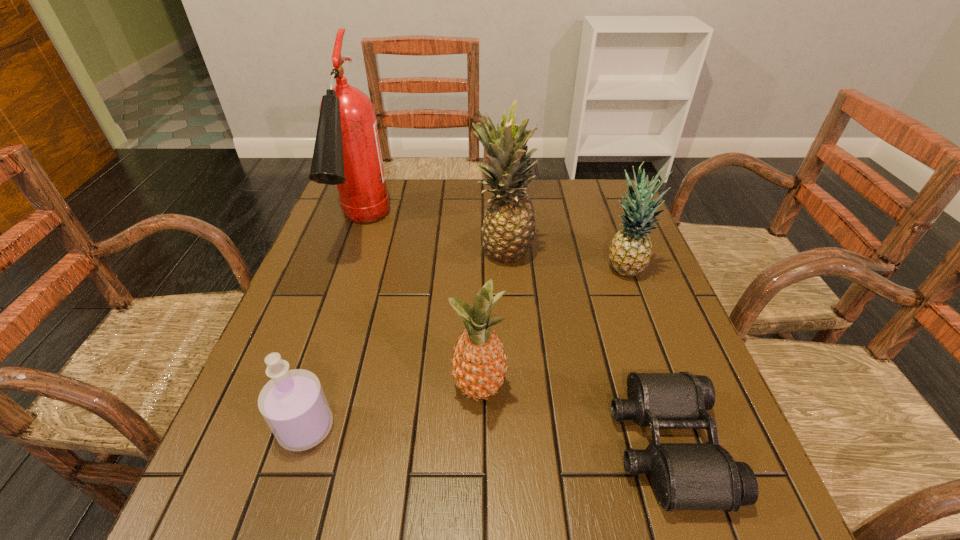
I want to click on vacant space that satisfies the following two spatial constraints: 1. at the nozzle end of the nearest pineapple; 2. on the left side of the tallest object, so click(x=307, y=390).

The height and width of the screenshot is (540, 960). Find the location of `free spot that satisfies the following two spatial constraints: 1. at the nozzle end of the tallest object; 2. on the left side of the fifth tallest object`. free spot that satisfies the following two spatial constraints: 1. at the nozzle end of the tallest object; 2. on the left side of the fifth tallest object is located at coordinates tap(294, 428).

Identify the location of free space that satisfies the following two spatial constraints: 1. at the nozzle end of the fire extinguisher; 2. on the left side of the perfume. This screenshot has width=960, height=540. (294, 428).

Locate an element on the screen. The width and height of the screenshot is (960, 540). vacant space that satisfies the following two spatial constraints: 1. at the nozzle end of the rightmost pineapple; 2. on the left side of the tallest object is located at coordinates (348, 271).

You are a GUI agent. You are given a task and a screenshot of the screen. Output one action in this format:
    pyautogui.click(x=<x>, y=<y>)
    Task: Click on the vacant space that satisfies the following two spatial constraints: 1. at the nozzle end of the fire extinguisher; 2. on the left side of the rightmost pineapple
    The height and width of the screenshot is (540, 960).
    Given the screenshot: What is the action you would take?
    pyautogui.click(x=348, y=271)

Locate an element on the screen. vacant position in the image that satisfies the following two spatial constraints: 1. at the nozzle end of the tallest object; 2. on the right side of the rightmost pineapple is located at coordinates (348, 271).